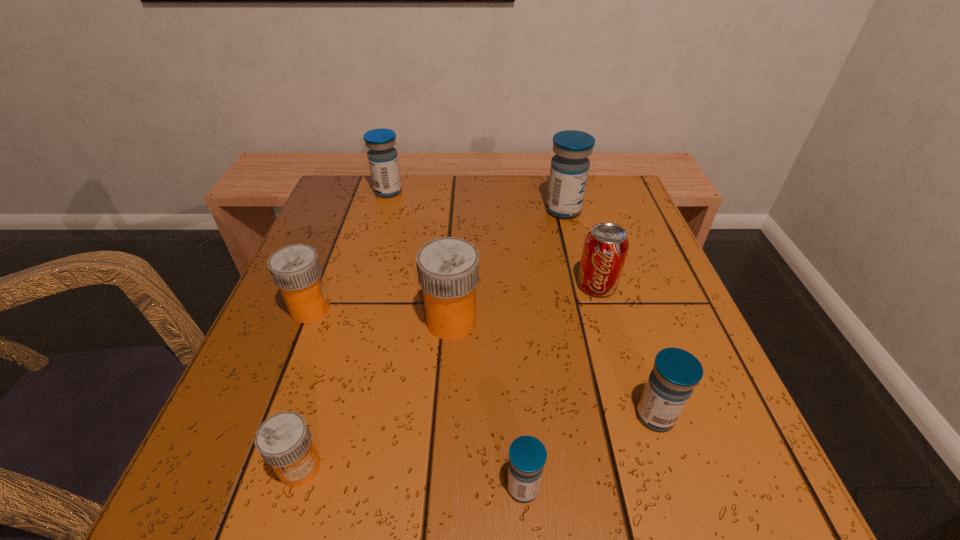
Locate an element on the screen. This screenshot has width=960, height=540. vacant area at the far right corner of the desktop is located at coordinates (600, 203).

Where is `vacant space at the near right corner of the desktop`? This screenshot has height=540, width=960. vacant space at the near right corner of the desktop is located at coordinates (745, 495).

Identify the location of unoccupied area between the third nearest object and the farthest blue medicine. Image resolution: width=960 pixels, height=540 pixels. (522, 303).

Image resolution: width=960 pixels, height=540 pixels. I want to click on vacant area that lies between the soda can and the fifth object from right to left, so click(524, 303).

At what (x,y) coordinates should I click in order to perform the action: click on vacant point located between the soda can and the third medicine from right to left. Please return your answer as a coordinate pair (x, y). Image resolution: width=960 pixels, height=540 pixels. Looking at the image, I should click on (560, 386).

The width and height of the screenshot is (960, 540). In order to click on free area in between the farthest medicine and the soda can in this screenshot , I will do `click(492, 239)`.

Image resolution: width=960 pixels, height=540 pixels. Identify the location of free space between the fifth object from right to left and the leftmost orange medicine. (381, 315).

Locate an element on the screen. free spot between the farthest blue medicine and the second smallest blue medicine is located at coordinates (522, 303).

The width and height of the screenshot is (960, 540). In order to click on free space between the smallest orange medicine and the leftmost object in this screenshot , I will do `click(305, 388)`.

Identify the location of the closest object to the farthest object. (295, 269).